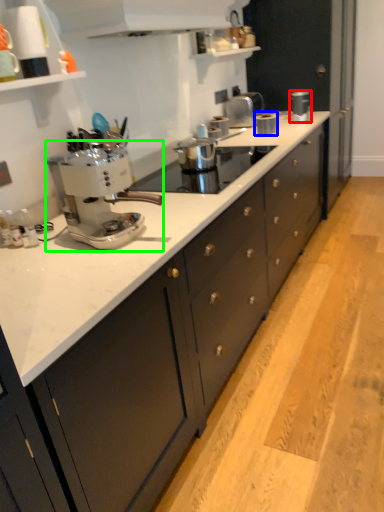
Question: Based on their relative distances, which object is farther from kitchen appliance (highlighted by a red box)? Choose from kitchen appliance (highlighted by a blue box) and coffee maker (highlighted by a green box).

Choices:
 (A) kitchen appliance
 (B) coffee maker

Answer: (B)